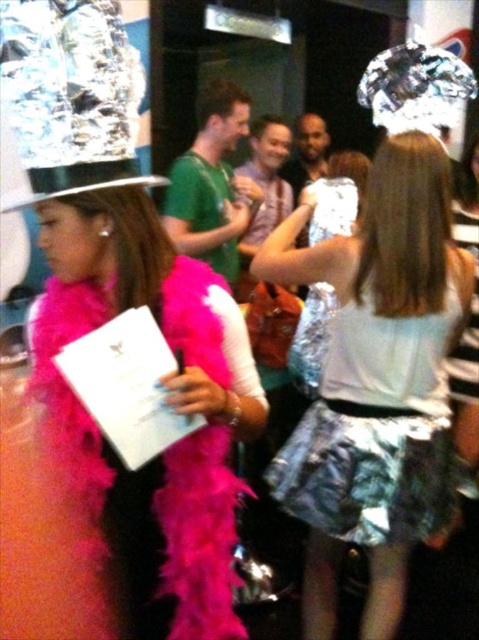
Between point (349, 256) and point (342, 193), which one is positioned in front?

Positioned in front is point (349, 256).

Can you confirm if shiny silver skirt at center is wider than shiny metallic dress at center?

Yes, shiny silver skirt at center is wider than shiny metallic dress at center.

Between point (400, 500) and point (309, 296), which one is positioned behind?

The point (309, 296) is behind.

Locate an element on the screen. This screenshot has width=479, height=640. shiny silver skirt at center is located at coordinates (373, 374).

Does point (179, 328) lie behind point (240, 92)?

No, (179, 328) is closer to viewer.

Is pink feather boa at center bigger than green matte shirt at center?

Actually, pink feather boa at center might be smaller than green matte shirt at center.

Is point (234, 620) positioned in front of point (229, 259)?

Yes, it is.

Find the location of a particular element. The image size is (479, 640). pink feather boa at center is located at coordinates (200, 534).

Measure the distance between shiny silver skirt at center and camera.

shiny silver skirt at center is 4.67 feet from camera.

Is shiny silver skirt at center taller than shiny silver hat at center?

Yes, shiny silver skirt at center is taller than shiny silver hat at center.

Who is more distant from viewer, (389, 147) or (307, 116)?

Point (307, 116)

Find the location of a particular element. shiny silver skirt at center is located at coordinates (373, 374).